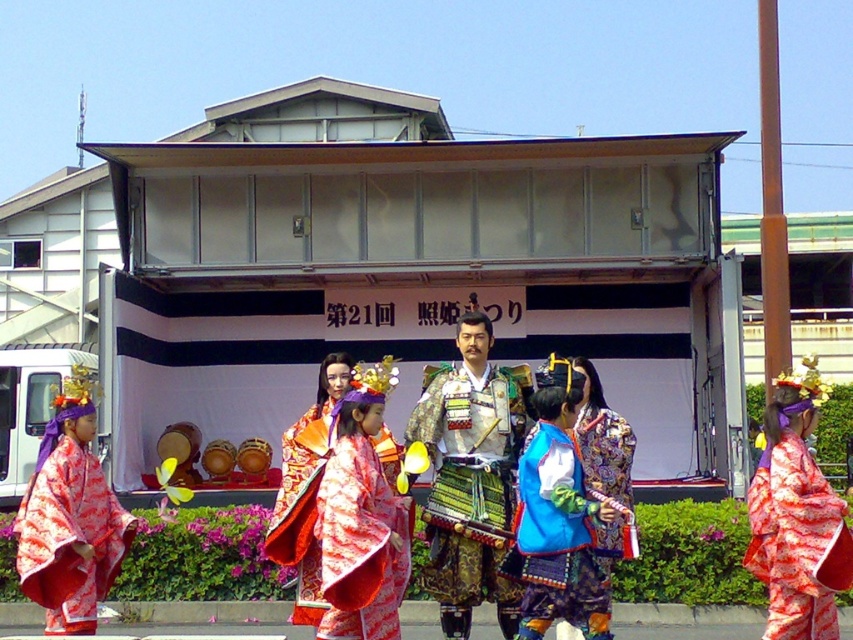
You are a photographer at the festival and want to capture a photo of the matte pink kimono at left and the blue satin kimono at center. Which kimono is located more to the left in the image?

The matte pink kimono at left is positioned on the left side of the blue satin kimono at center, so the matte pink kimono at left is more to the left.

You are a photographer at the festival and want to capture both the green textured armor at center and the blue satin kimono at center in the same frame. Based on their positions, which one should you focus on first to ensure both are in the shot?

The green textured armor at center is positioned on the left side of blue satin kimono at center. To capture both in the same frame, focus on the blue satin kimono at center first as it is on the right, ensuring the leftward green textured armor at center also fits within the shot.